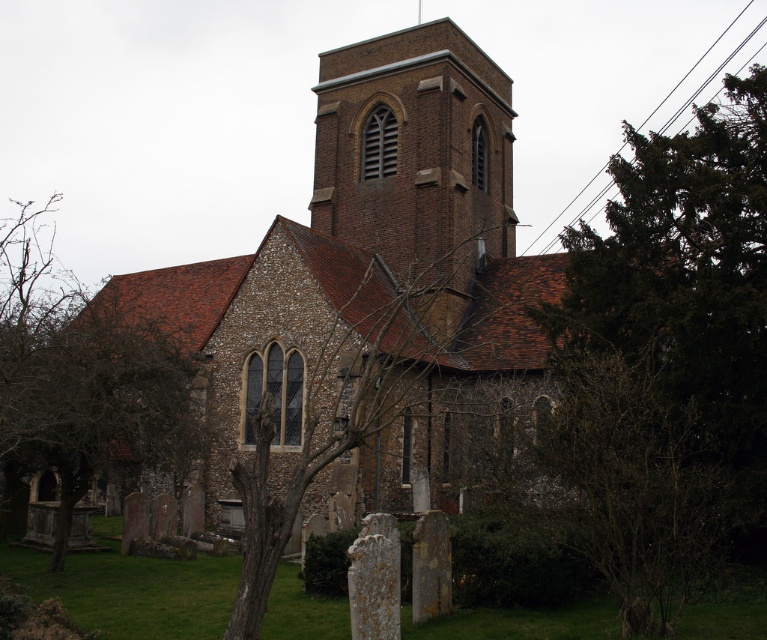
You are standing in front of the church and want to take a photo of the bare branches at center without the green leafy tree at lower left blocking the view. Is this possible?

The bare branches at center is behind the green leafy tree at lower left, so it would be blocked by the tree and not visible in the photo.

You are standing in the graveyard and want to take a photo of the brown stone church at center and the green leafy tree at lower left. Which object should you frame first in your camera to ensure both are in the shot?

The brown stone church at center is narrower than the green leafy tree at lower left, so you should frame the green leafy tree at lower left first to ensure both fit in the shot.